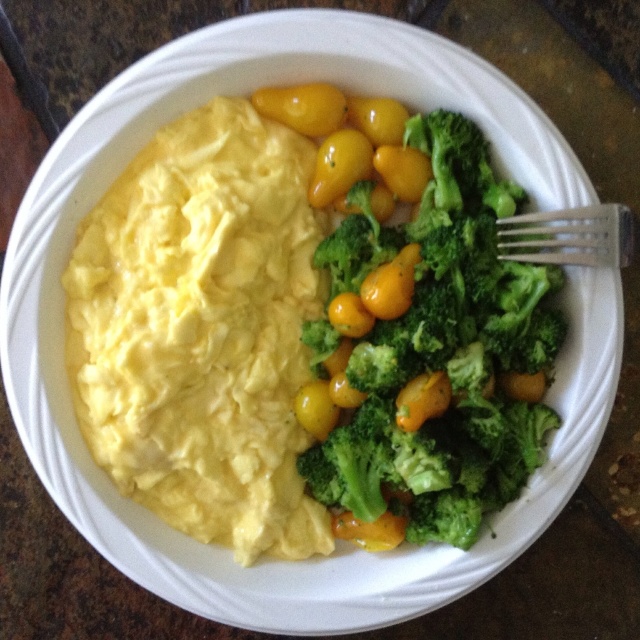
Question: Which point is farther to the camera?

Choices:
 (A) (275, 216)
 (B) (618, 221)

Answer: (A)

Question: Considering the relative positions of yellow creamy scrambled eggs at left and silver metallic fork at upper right in the image provided, where is yellow creamy scrambled eggs at left located with respect to silver metallic fork at upper right?

Choices:
 (A) above
 (B) below

Answer: (B)

Question: Does yellow creamy scrambled eggs at left lie behind green fresh broccoli at right?

Choices:
 (A) yes
 (B) no

Answer: (A)

Question: Considering the relative positions of yellow creamy scrambled eggs at left and green fresh broccoli at right in the image provided, where is yellow creamy scrambled eggs at left located with respect to green fresh broccoli at right?

Choices:
 (A) left
 (B) right

Answer: (A)

Question: Which object appears closest to the camera in this image?

Choices:
 (A) green fresh broccoli at right
 (B) yellow creamy scrambled eggs at left
 (C) silver metallic fork at upper right

Answer: (C)

Question: Which object appears farthest from the camera in this image?

Choices:
 (A) yellow creamy scrambled eggs at left
 (B) green fresh broccoli at right

Answer: (A)